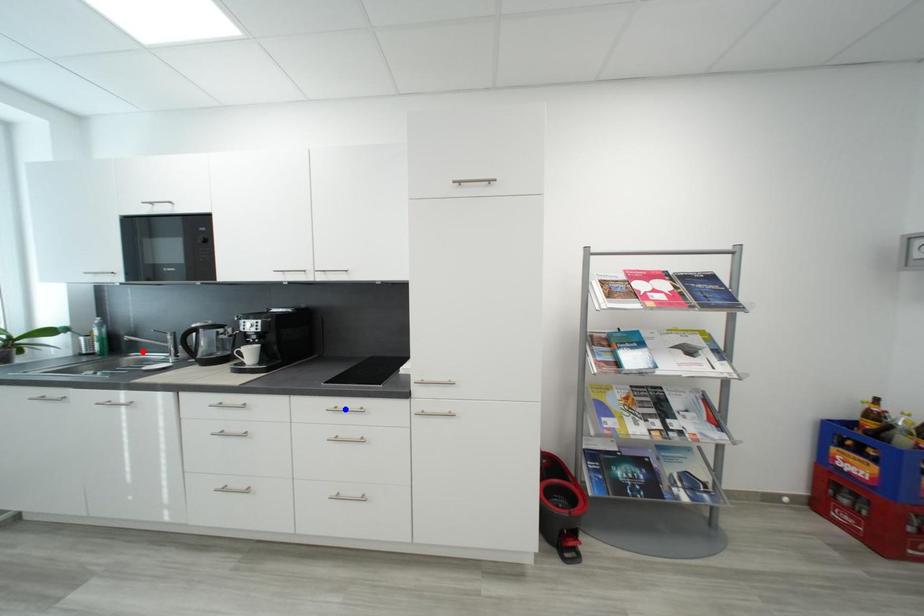
Question: Which of the two points in the image is closer to the camera?

Choices:
 (A) Blue point is closer.
 (B) Red point is closer.

Answer: (A)